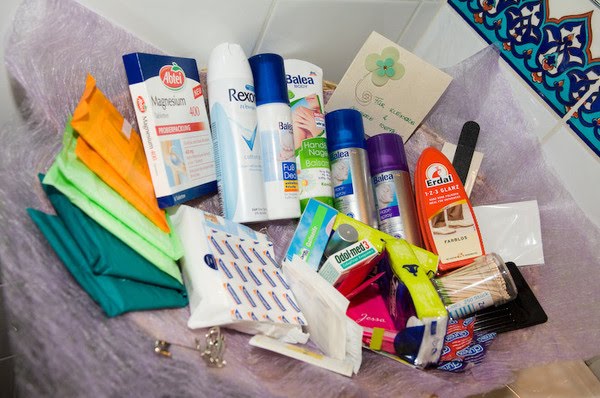
The image size is (600, 398). What are the coordinates of `tiles` in the screenshot? It's located at (570, 161), (529, 120), (543, 65), (591, 118), (336, 19), (222, 23).